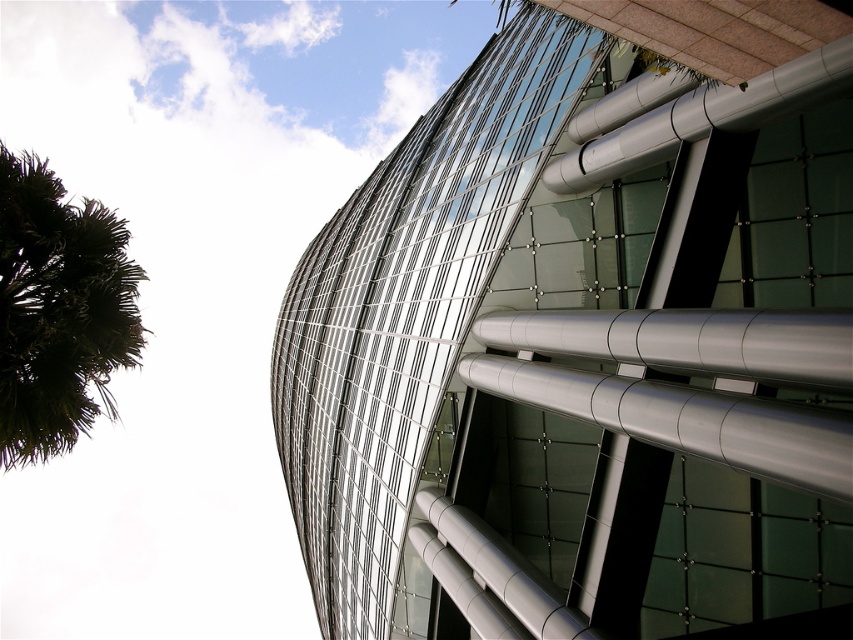
From the picture: Is transparent glass building at upper center thinner than green leafy palm tree at left?

In fact, transparent glass building at upper center might be wider than green leafy palm tree at left.

Who is taller, transparent glass building at upper center or green leafy palm tree at left?

transparent glass building at upper center

Find the location of a particular element. This screenshot has width=853, height=640. transparent glass building at upper center is located at coordinates (589, 340).